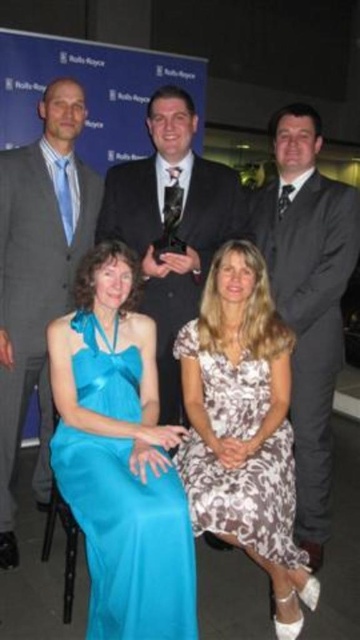
Question: Which of the following is the farthest from the observer?

Choices:
 (A) (192, 298)
 (B) (60, 380)
 (C) (209, 509)

Answer: (A)

Question: Which point is closer to the camera?

Choices:
 (A) satin blue dress at lower left
 (B) brown floral dress at lower center
 (C) dark gray suit at center

Answer: (A)

Question: Is satin blue dress at lower left to the right of shiny black suit at center from the viewer's perspective?

Choices:
 (A) yes
 (B) no

Answer: (B)

Question: Where is gray suit at left located in relation to shiny black suit at center in the image?

Choices:
 (A) below
 (B) above

Answer: (A)

Question: Can you confirm if satin blue dress at lower left is thinner than brown floral dress at lower center?

Choices:
 (A) no
 (B) yes

Answer: (A)

Question: Considering the real-world distances, which object is farthest from the shiny black suit at center?

Choices:
 (A) brown floral dress at lower center
 (B) satin blue dress at lower left
 (C) dark gray suit at center

Answer: (B)